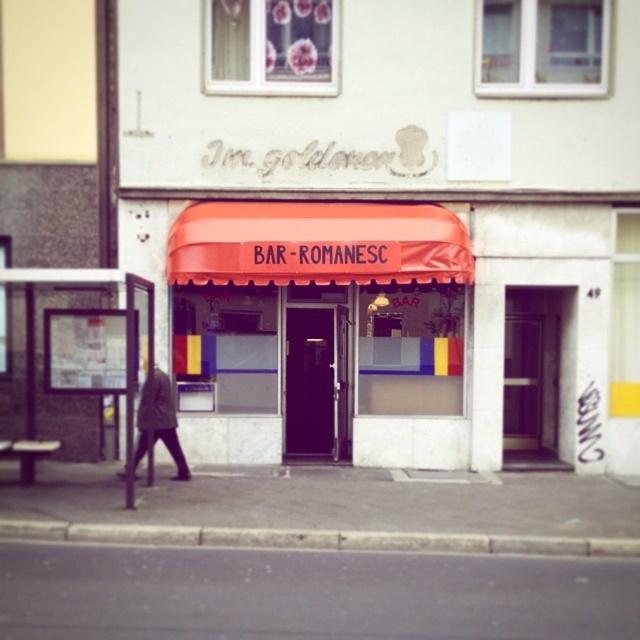
Question: Which point appears farthest from the camera in this image?

Choices:
 (A) (74, 272)
 (B) (243, 3)
 (C) (156, 422)
 (D) (4, 552)

Answer: (B)

Question: Can you confirm if gray concrete pavement at lower center is thinner than dark gray coat at left?

Choices:
 (A) no
 (B) yes

Answer: (A)

Question: Where is gray concrete pavement at lower center located in relation to dark gray coat at left in the image?

Choices:
 (A) right
 (B) left

Answer: (A)

Question: Which of the following is the closest to the observer?

Choices:
 (A) gray concrete pavement at lower center
 (B) black asphalt at lower center
 (C) orange fabric awning at center
 (D) transparent glass bus stop at left

Answer: (B)

Question: Is orange fabric awning at center to the right of gray concrete pavement at lower center from the viewer's perspective?

Choices:
 (A) no
 (B) yes

Answer: (A)

Question: Which object is positioned farthest from the dark gray coat at left?

Choices:
 (A) orange fabric awning at center
 (B) black asphalt at lower center
 (C) gray concrete pavement at lower center

Answer: (C)